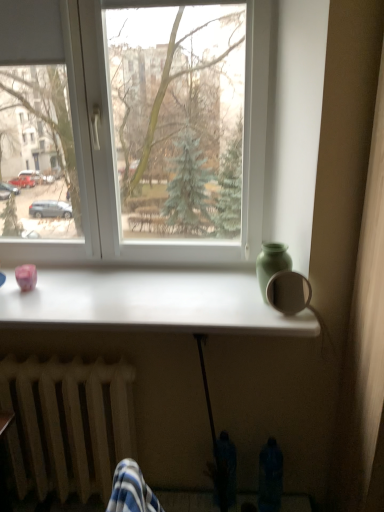
Question: Considering the relative sizes of white glossy table at center and green matte vase at upper right in the image provided, is white glossy table at center taller than green matte vase at upper right?

Choices:
 (A) no
 (B) yes

Answer: (A)

Question: Would you consider white glossy table at center to be distant from green matte vase at upper right?

Choices:
 (A) yes
 (B) no

Answer: (B)

Question: Is white glossy table at center turned away from green matte vase at upper right?

Choices:
 (A) no
 (B) yes

Answer: (A)

Question: Is white glossy table at center to the left of green matte vase at upper right from the viewer's perspective?

Choices:
 (A) yes
 (B) no

Answer: (A)

Question: Considering the relative positions of white glossy table at center and green matte vase at upper right in the image provided, is white glossy table at center behind green matte vase at upper right?

Choices:
 (A) yes
 (B) no

Answer: (B)

Question: From a real-world perspective, is white glossy table at center below green matte vase at upper right?

Choices:
 (A) yes
 (B) no

Answer: (A)

Question: Is white plastic window at center further to camera compared to wooden radiator at lower left?

Choices:
 (A) yes
 (B) no

Answer: (A)

Question: Considering the relative sizes of white plastic window at center and wooden radiator at lower left in the image provided, is white plastic window at center taller than wooden radiator at lower left?

Choices:
 (A) yes
 (B) no

Answer: (A)

Question: Is the surface of white plastic window at center in direct contact with wooden radiator at lower left?

Choices:
 (A) yes
 (B) no

Answer: (B)

Question: Can you confirm if white plastic window at center is shorter than wooden radiator at lower left?

Choices:
 (A) no
 (B) yes

Answer: (A)

Question: From the image's perspective, is white plastic window at center below wooden radiator at lower left?

Choices:
 (A) no
 (B) yes

Answer: (A)

Question: Is white plastic window at center to the right of wooden radiator at lower left from the viewer's perspective?

Choices:
 (A) no
 (B) yes

Answer: (B)

Question: Considering the relative sizes of wooden radiator at lower left and white plastic window at center in the image provided, is wooden radiator at lower left wider than white plastic window at center?

Choices:
 (A) no
 (B) yes

Answer: (B)